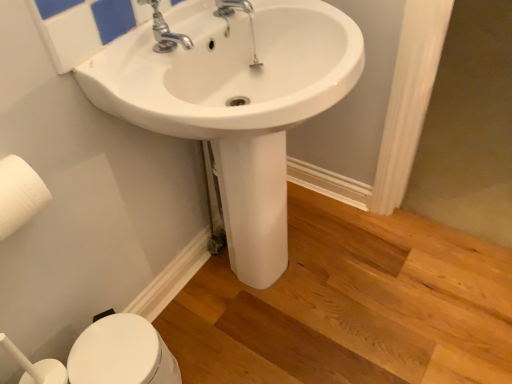
Where is `vacant point above white glossy bidet at lower left (from a real-world perspective)`? vacant point above white glossy bidet at lower left (from a real-world perspective) is located at coordinates (115, 352).